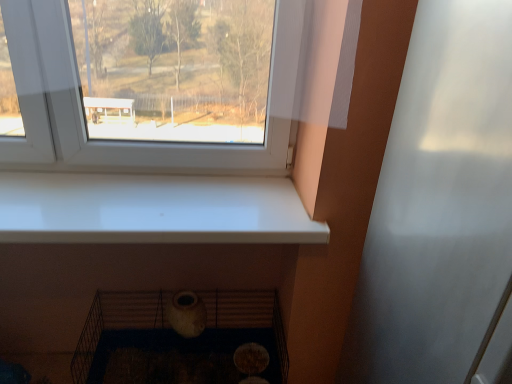
Measure the distance between transparent plastic screen door at right and camera.

transparent plastic screen door at right is 22.27 inches from camera.

This screenshot has width=512, height=384. What do you see at coordinates (439, 204) in the screenshot?
I see `transparent plastic screen door at right` at bounding box center [439, 204].

I want to click on transparent plastic screen door at right, so click(x=439, y=204).

Measure the distance between point (124, 320) and camera.

Point (124, 320) is 5.46 feet from camera.

You are a GUI agent. You are given a task and a screenshot of the screen. Output one action in this format:
    pyautogui.click(x=<x>, y=<y>)
    Task: Click on the matte ceramic vase at lower center
    
    Given the screenshot: What is the action you would take?
    pyautogui.click(x=116, y=321)

Image resolution: width=512 pixels, height=384 pixels. Describe the element at coordinates (116, 321) in the screenshot. I see `matte ceramic vase at lower center` at that location.

Locate an element on the screen. This screenshot has height=384, width=512. transparent plastic screen door at right is located at coordinates (439, 204).

Can you confirm if transparent plastic screen door at right is positioned to the right of matte ceramic vase at lower center?

Correct, you'll find transparent plastic screen door at right to the right of matte ceramic vase at lower center.

Is the position of transparent plastic screen door at right more distant than that of matte ceramic vase at lower center?

No, transparent plastic screen door at right is in front of matte ceramic vase at lower center.

Which point is more distant from viewer, (x=440, y=368) or (x=236, y=303)?

The point (x=236, y=303) is farther.

From the image's perspective, who appears lower, transparent plastic screen door at right or matte ceramic vase at lower center?

From the image's view, matte ceramic vase at lower center is below.

From a real-world perspective, is transparent plastic screen door at right beneath matte ceramic vase at lower center?

No, from a real-world perspective, transparent plastic screen door at right is not beneath matte ceramic vase at lower center.

Considering the sizes of transparent plastic screen door at right and matte ceramic vase at lower center in the image, is transparent plastic screen door at right wider or thinner than matte ceramic vase at lower center?

transparent plastic screen door at right is wider than matte ceramic vase at lower center.

Between transparent plastic screen door at right and matte ceramic vase at lower center, which one has more height?

With more height is transparent plastic screen door at right.

Does transparent plastic screen door at right have a larger size compared to matte ceramic vase at lower center?

Indeed, transparent plastic screen door at right has a larger size compared to matte ceramic vase at lower center.

Is transparent plastic screen door at right outside of matte ceramic vase at lower center?

Indeed, transparent plastic screen door at right is completely outside matte ceramic vase at lower center.

Are transparent plastic screen door at right and matte ceramic vase at lower center making contact?

transparent plastic screen door at right and matte ceramic vase at lower center are not in contact.

Is transparent plastic screen door at right turned away from matte ceramic vase at lower center?

That's not correct — transparent plastic screen door at right is not looking away from matte ceramic vase at lower center.

Can you tell me how much transparent plastic screen door at right and matte ceramic vase at lower center differ in facing direction?

They differ by 0.825 degrees in their facing directions.

You are a GUI agent. You are given a task and a screenshot of the screen. Output one action in this format:
    pyautogui.click(x=<x>, y=<y>)
    Task: Click on the shelf that is on the left side of transparent plastic screen door at right
    The width and height of the screenshot is (512, 384).
    Given the screenshot: What is the action you would take?
    pyautogui.click(x=116, y=321)

Based on their positions, is matte ceramic vase at lower center located to the left or right of transparent plastic screen door at right?

Clearly, matte ceramic vase at lower center is on the left of transparent plastic screen door at right in the image.

Which object is closer to the camera, matte ceramic vase at lower center or transparent plastic screen door at right?

transparent plastic screen door at right is closer to the camera.

Which point is more distant from viewer, (120, 294) or (444, 74)?

The point (120, 294) is behind.

From the image's perspective, is matte ceramic vase at lower center above transparent plastic screen door at right?

No, from the image's perspective, matte ceramic vase at lower center is not above transparent plastic screen door at right.

From a real-world perspective, is matte ceramic vase at lower center beneath transparent plastic screen door at right?

Indeed, from a real-world perspective, matte ceramic vase at lower center is positioned beneath transparent plastic screen door at right.

Considering the sizes of matte ceramic vase at lower center and transparent plastic screen door at right in the image, is matte ceramic vase at lower center wider or thinner than transparent plastic screen door at right?

Considering their sizes, matte ceramic vase at lower center looks slimmer than transparent plastic screen door at right.

In terms of height, does matte ceramic vase at lower center look taller or shorter compared to transparent plastic screen door at right?

In the image, matte ceramic vase at lower center appears to be shorter than transparent plastic screen door at right.

Considering the sizes of matte ceramic vase at lower center and transparent plastic screen door at right in the image, is matte ceramic vase at lower center bigger or smaller than transparent plastic screen door at right?

In the image, matte ceramic vase at lower center appears to be smaller than transparent plastic screen door at right.

From the picture: Which is correct: matte ceramic vase at lower center is inside transparent plastic screen door at right, or outside of it?

matte ceramic vase at lower center is spatially situated outside transparent plastic screen door at right.

Is the surface of matte ceramic vase at lower center in direct contact with transparent plastic screen door at right?

No, matte ceramic vase at lower center is not making contact with transparent plastic screen door at right.

Is matte ceramic vase at lower center turned away from transparent plastic screen door at right?

No.

Can you tell me how much matte ceramic vase at lower center and transparent plastic screen door at right differ in facing direction?

The angle between the facing direction of matte ceramic vase at lower center and the facing direction of transparent plastic screen door at right is 0.825 degrees.

Measure the distance between matte ceramic vase at lower center and transparent plastic screen door at right.

A distance of 31.36 inches exists between matte ceramic vase at lower center and transparent plastic screen door at right.

Where is `screen door above the matte ceramic vase at lower center (from a real-world perspective)`? screen door above the matte ceramic vase at lower center (from a real-world perspective) is located at coordinates (439, 204).

Identify the location of screen door above the matte ceramic vase at lower center (from a real-world perspective). (439, 204).

The width and height of the screenshot is (512, 384). In order to click on screen door in front of the matte ceramic vase at lower center in this screenshot , I will do `click(439, 204)`.